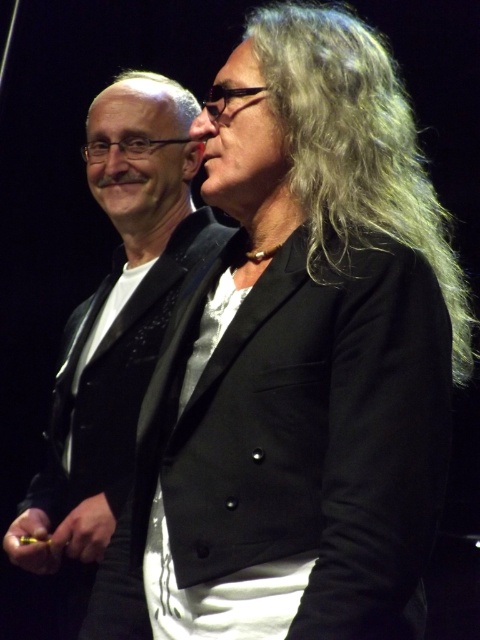
Question: Which point is farther from the camera taking this photo?

Choices:
 (A) (315, 145)
 (B) (402, 108)
 (C) (85, 168)

Answer: (C)

Question: Among these objects, which one is nearest to the camera?

Choices:
 (A) matte black vest at left
 (B) matte black hair at center
 (C) smooth skin nose at center

Answer: (B)

Question: Observing the image, what is the correct spatial positioning of gray matte hair at upper right in reference to matte black face at upper left?

Choices:
 (A) above
 (B) below

Answer: (B)

Question: From the image, what is the correct spatial relationship of black glossy suit at center in relation to matte black nose at upper center?

Choices:
 (A) below
 (B) above

Answer: (A)

Question: Which point is farther to the camera?

Choices:
 (A) matte black face at upper left
 (B) smooth skin nose at center
 (C) gray matte hair at upper right
 (D) matte black vest at left

Answer: (A)

Question: Can you confirm if gray matte hair at upper right is positioned below matte black nose at upper center?

Choices:
 (A) yes
 (B) no

Answer: (A)